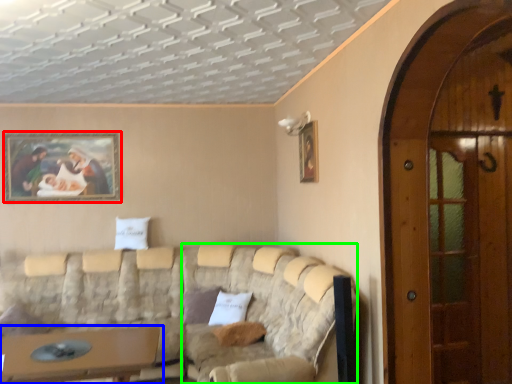
Question: Which object is positioned farthest from picture frame (highlighted by a red box)? Select from table (highlighted by a blue box) and couch (highlighted by a green box).

Choices:
 (A) table
 (B) couch

Answer: (A)